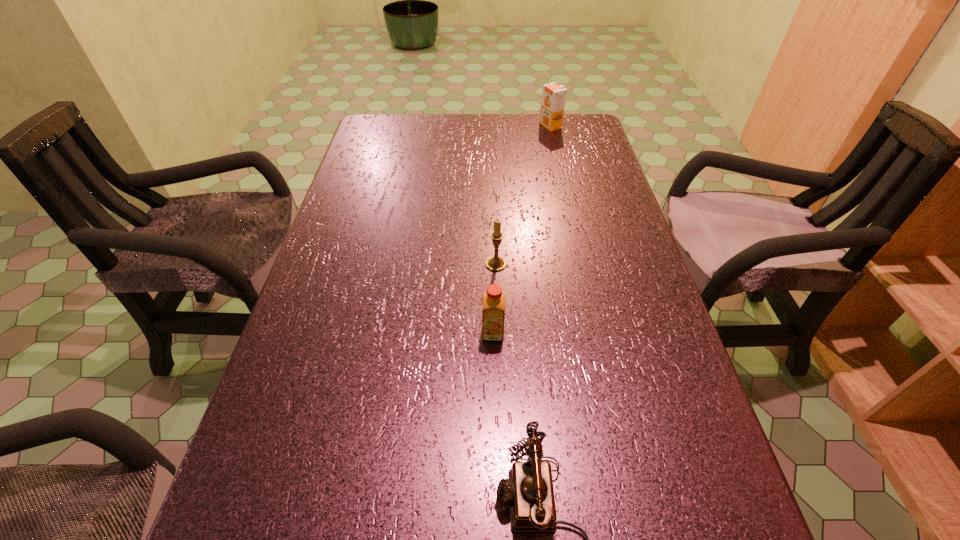
Where is `object at the far right corner`? object at the far right corner is located at coordinates (553, 95).

This screenshot has width=960, height=540. What are the coordinates of `vacant space at the far edge of the desktop` in the screenshot? It's located at (528, 115).

Find the location of a particular element. This screenshot has height=540, width=960. vacant area at the left edge is located at coordinates (329, 257).

You are a GUI agent. You are given a task and a screenshot of the screen. Output one action in this format:
    pyautogui.click(x=<x>, y=<y>)
    Task: Click on the free space at the right edge
    
    Given the screenshot: What is the action you would take?
    pyautogui.click(x=628, y=428)

Identify the location of vacant space that is in between the candle holder and the farther orange juice. The image size is (960, 540). (523, 195).

In order to click on free space between the candle holder and the right orange juice in this screenshot , I will do `click(523, 195)`.

Find the location of a particular element. The width and height of the screenshot is (960, 540). object that is the nearest to the second farthest object is located at coordinates (493, 300).

Locate an element on the screen. The image size is (960, 540). the third closest object to the shortest object is located at coordinates (553, 95).

Locate an element on the screen. The image size is (960, 540). free region that satisfies the following two spatial constraints: 1. on the back side of the farther orange juice; 2. on the left side of the candle holder is located at coordinates (491, 126).

Identify the location of free space that satisfies the following two spatial constraints: 1. on the back side of the candle holder; 2. on the right side of the right orange juice. (491, 126).